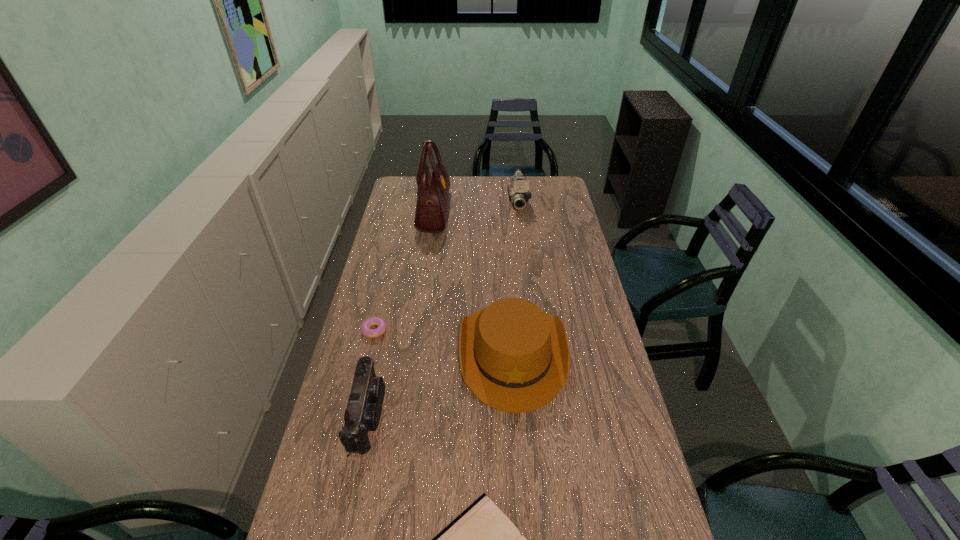
This screenshot has height=540, width=960. In the image, there is a desktop. Identify the location of free space at the left edge. (391, 312).

In the image, there is a desktop. Find the location of `vacant space at the right edge`. vacant space at the right edge is located at coordinates (593, 497).

You are a GUI agent. You are given a task and a screenshot of the screen. Output one action in this format:
    pyautogui.click(x=<x>, y=<y>)
    Task: Click on the vacant space at the far left corner of the desktop
    
    Given the screenshot: What is the action you would take?
    (x=405, y=188)

Where is `vacant region at the far right corner of the desktop`? vacant region at the far right corner of the desktop is located at coordinates (541, 180).

Where is `free space between the handbag and the doughnut`? The height and width of the screenshot is (540, 960). free space between the handbag and the doughnut is located at coordinates (404, 271).

Identify the location of free space between the cowboy hat and the doughnut. This screenshot has height=540, width=960. (444, 341).

At what (x,y) coordinates should I click in order to perform the action: click on unoccupied area between the farther camcorder and the tallest object. Please return your answer as a coordinate pair (x, y). This screenshot has height=540, width=960. Looking at the image, I should click on (476, 205).

Locate an element on the screen. Image resolution: width=960 pixels, height=540 pixels. unoccupied position between the farther camcorder and the cowboy hat is located at coordinates (516, 276).

Where is `free space between the cowboy hat and the doughnut`? free space between the cowboy hat and the doughnut is located at coordinates (444, 341).

The width and height of the screenshot is (960, 540). I want to click on vacant area that lies between the nearer camcorder and the tallest object, so click(401, 313).